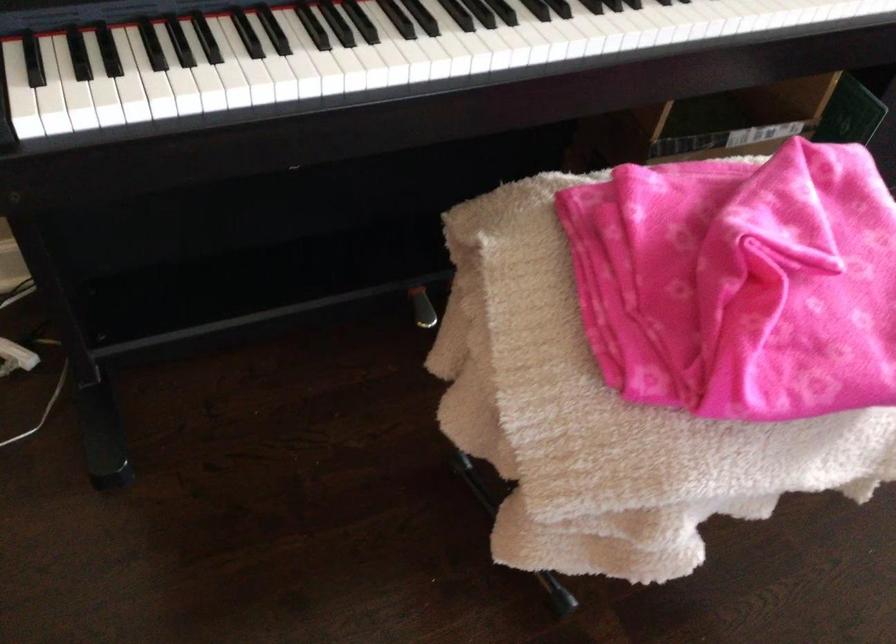
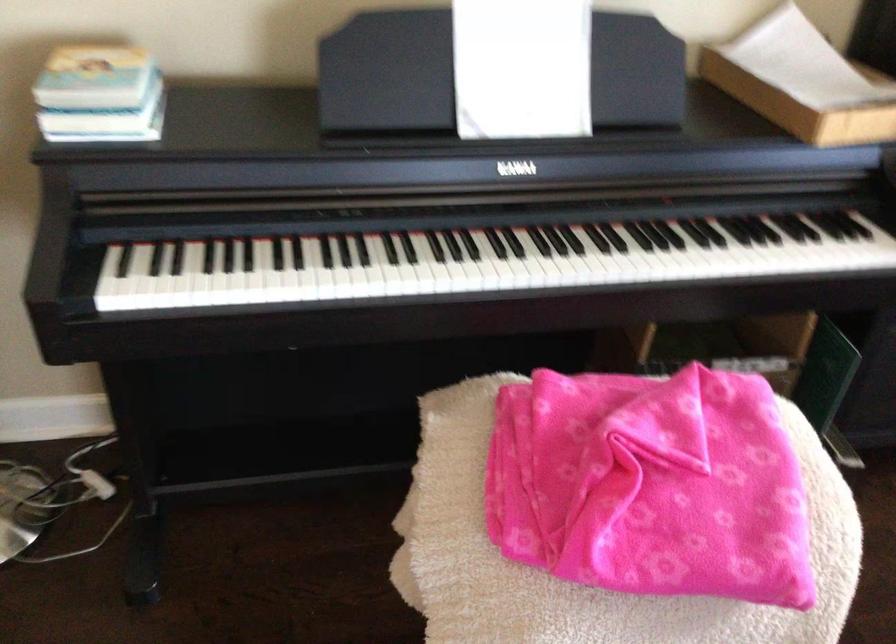
Question: The first image is from the beginning of the video and the second image is from the end. How did the camera likely rotate when shooting the video?

Choices:
 (A) Left
 (B) Right
 (C) Up
 (D) Down

Answer: (C)